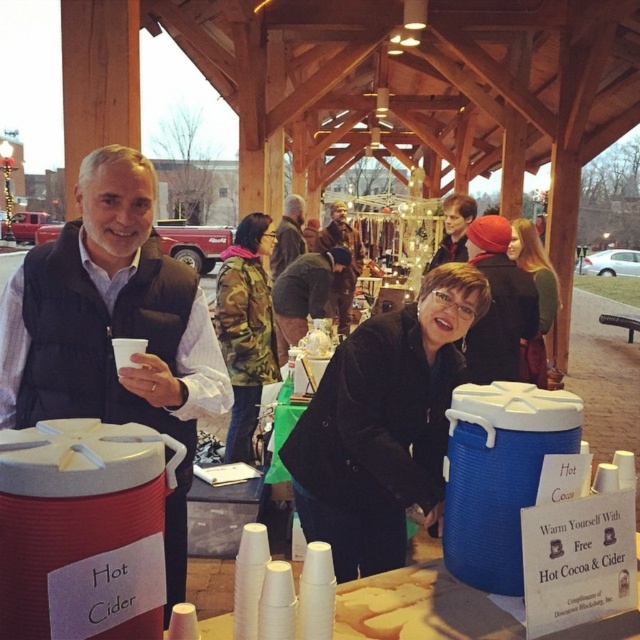
Who is shorter, black velvet coat at center or brown leather jacket at center?

brown leather jacket at center is shorter.

Is black velvet coat at center wider than brown leather jacket at center?

Yes.

You are a GUI agent. You are given a task and a screenshot of the screen. Output one action in this format:
    pyautogui.click(x=<x>, y=<y>)
    Task: Click on the black velvet coat at center
    This screenshot has width=640, height=640.
    Given the screenshot: What is the action you would take?
    pyautogui.click(x=381, y=426)

Find the location of a particular element. The height and width of the screenshot is (640, 640). black velvet coat at center is located at coordinates (381, 426).

Which of these two, matte black vest at left or brown fuzzy coat at center, stands taller?

brown fuzzy coat at center is taller.

Can you confirm if matte black vest at left is bigger than brown fuzzy coat at center?

No, matte black vest at left is not bigger than brown fuzzy coat at center.

Is point (52, 371) positioned before point (337, 296)?

That is True.

Locate an element on the screen. matte black vest at left is located at coordinates (113, 330).

Does matte black vest at left lie behind brown leather jacket at center?

No, it is not.

Between matte black vest at left and brown leather jacket at center, which one has more height?

matte black vest at left is taller.

Is point (209, 371) positioned behind point (282, 257)?

No, (209, 371) is closer to viewer.

Image resolution: width=640 pixels, height=640 pixels. Find the location of `matte black vest at left`. matte black vest at left is located at coordinates (113, 330).